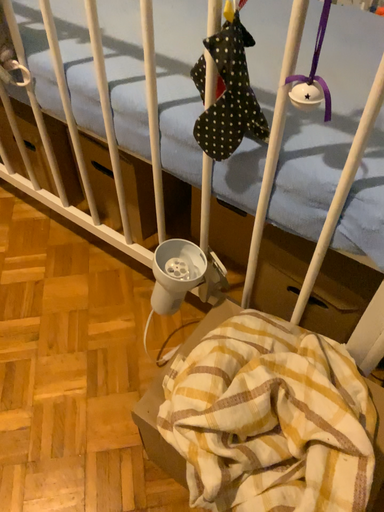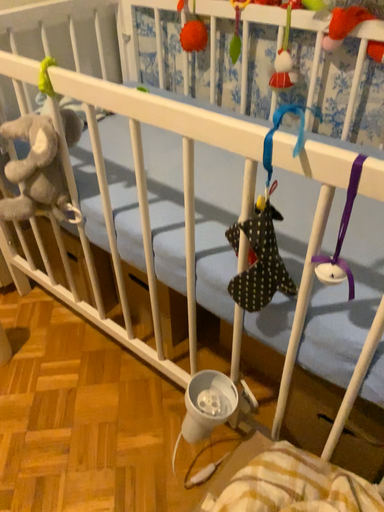
Question: Which way did the camera rotate in the video?

Choices:
 (A) rotated downward
 (B) rotated upward

Answer: (B)